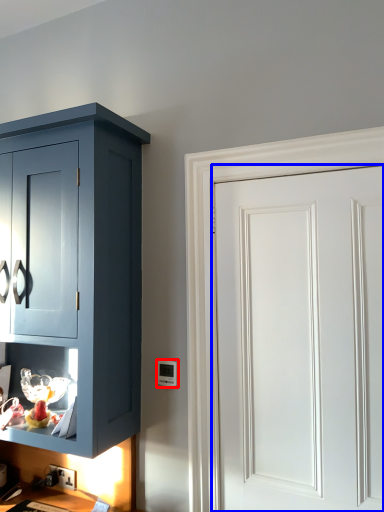
Question: Which object appears farthest to the camera in this image, light switch (highlighted by a red box) or door (highlighted by a blue box)?

Choices:
 (A) light switch
 (B) door

Answer: (A)